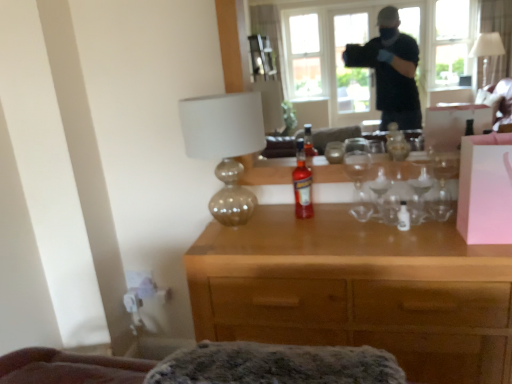
Question: Considering the positions of point (285, 23) and point (243, 259), is point (285, 23) closer or farther from the camera than point (243, 259)?

Choices:
 (A) farther
 (B) closer

Answer: (A)

Question: From a real-world perspective, is transparent glass window at upper center physically located above or below wooden desk at center?

Choices:
 (A) above
 (B) below

Answer: (A)

Question: Which of these objects is positioned farthest from the pink matte box at right?

Choices:
 (A) matte gold lamp at center
 (B) transparent glass window at upper center
 (C) translucent glass bottle at center
 (D) wooden desk at center

Answer: (B)

Question: Based on their relative distances, which object is nearer to the transparent glass window at upper center?

Choices:
 (A) translucent glass bottle at center
 (B) pink matte box at right
 (C) wooden desk at center
 (D) matte gold lamp at center

Answer: (A)